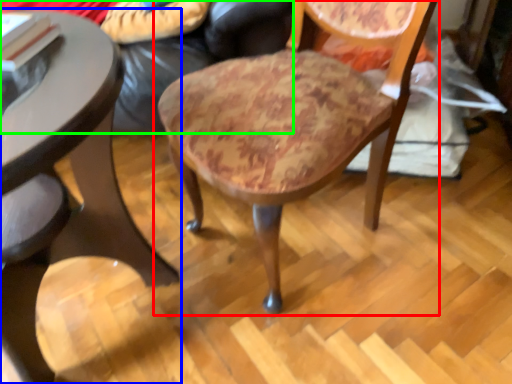
Question: Which object is the farthest from chair (highlighted by a red box)? Choose among these: table (highlighted by a blue box) or couch (highlighted by a green box).

Choices:
 (A) table
 (B) couch

Answer: (A)